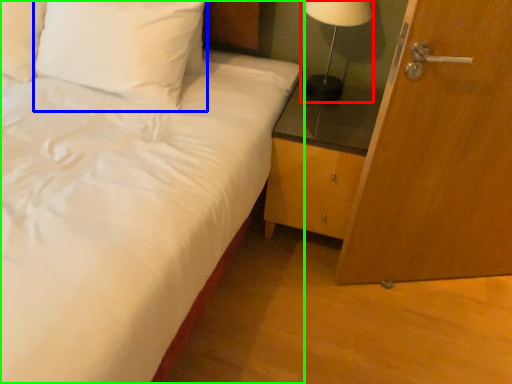
Question: Estimate the real-world distances between objects in this image. Which object is farther from table lamp (highlighted by a red box), pillow (highlighted by a blue box) or bed (highlighted by a green box)?

Choices:
 (A) pillow
 (B) bed

Answer: (B)